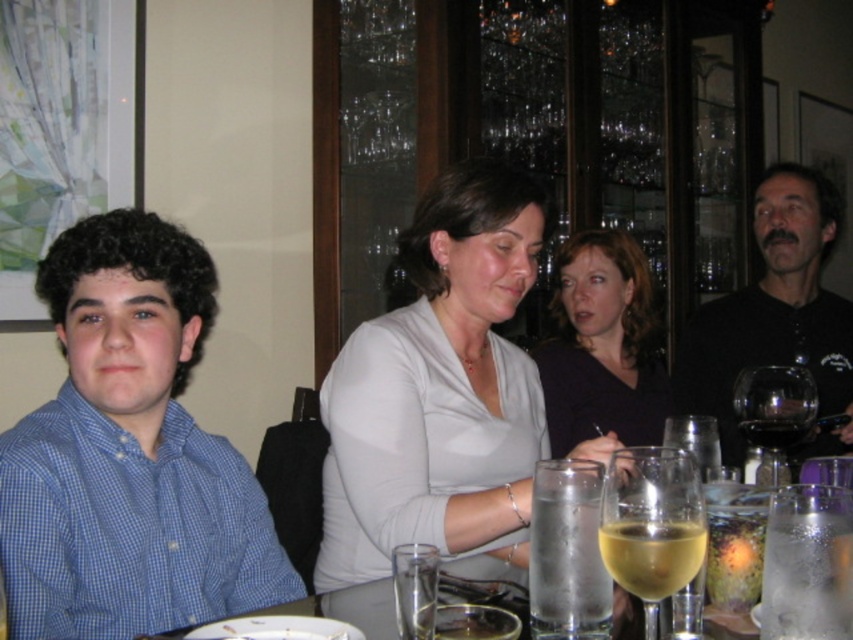
Question: Which object is farther from the camera taking this photo?

Choices:
 (A) transparent glass wine glass at right
 (B) dark purple shirt at center

Answer: (B)

Question: Can you confirm if translucent glass wine glass at lower center is positioned to the left of clear glass wine at center?

Choices:
 (A) yes
 (B) no

Answer: (A)

Question: Estimate the real-world distances between objects in this image. Which object is closer to the dark purple shirt at center?

Choices:
 (A) clear glass wine at center
 (B) black matte shirt at right
 (C) matte white blouse at center

Answer: (B)

Question: Which point is closer to the camera?

Choices:
 (A) yellow translucent wine glass at lower center
 (B) transparent glass wine glass at right
 (C) clear glass wine at center

Answer: (A)

Question: Is black matte shirt at right to the left of dark purple shirt at center from the viewer's perspective?

Choices:
 (A) no
 (B) yes

Answer: (A)

Question: Is blue checkered shirt at left thinner than matte white blouse at center?

Choices:
 (A) yes
 (B) no

Answer: (A)